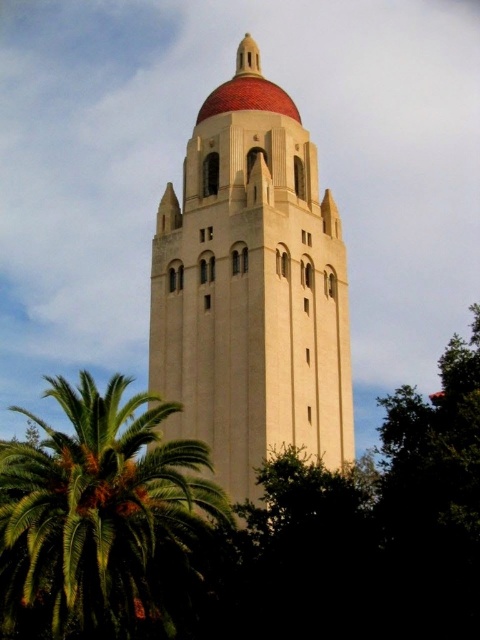
Between beige stone tower at center and green leafy palm at lower left, which one has more height?

beige stone tower at center

Is beige stone tower at center to the right of green leafy palm at lower left from the viewer's perspective?

Correct, you'll find beige stone tower at center to the right of green leafy palm at lower left.

Where is `beige stone tower at center`? The width and height of the screenshot is (480, 640). beige stone tower at center is located at coordinates (252, 289).